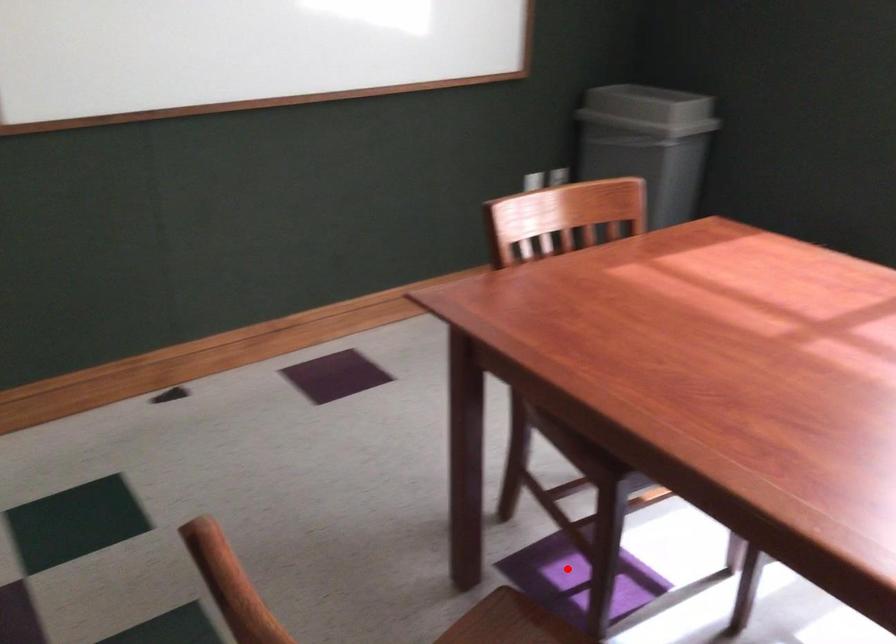
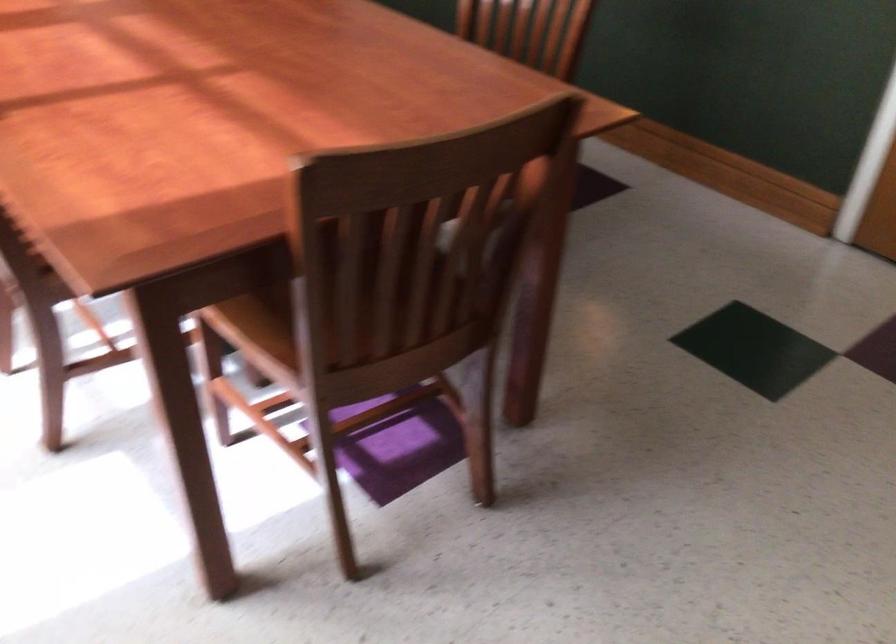
Question: I am providing you with two images of the same scene from different viewpoints. Given a red point in image1, look at the same physical point in image2. Is it:

Choices:
 (A) Closer to the viewpoint
 (B) Farther from the viewpoint

Answer: (A)